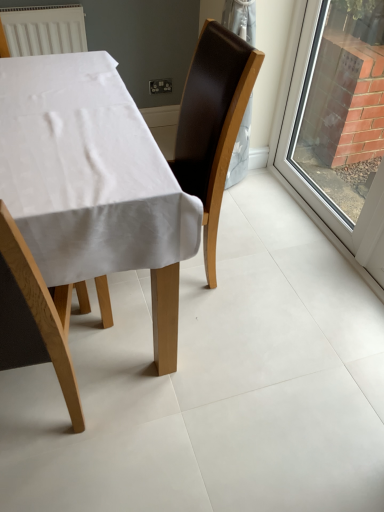
Question: Are clear glass window at right and brown leather chair at center, the first chair positioned from the back, far apart?

Choices:
 (A) no
 (B) yes

Answer: (A)

Question: Considering the relative sizes of clear glass window at right and brown leather chair at center, the first chair positioned from the back, in the image provided, is clear glass window at right smaller than brown leather chair at center, the first chair positioned from the back,?

Choices:
 (A) no
 (B) yes

Answer: (B)

Question: Does clear glass window at right contain brown leather chair at center, the first chair positioned from the back?

Choices:
 (A) yes
 (B) no

Answer: (B)

Question: Is brown leather chair at center, the first chair positioned from the back, at the back of clear glass window at right?

Choices:
 (A) no
 (B) yes

Answer: (A)

Question: Is clear glass window at right thinner than brown leather chair at center, the first chair positioned from the back?

Choices:
 (A) yes
 (B) no

Answer: (A)

Question: From a real-world perspective, is clear glass window at right on brown leather chair at center, the 2th chair from the front?

Choices:
 (A) no
 (B) yes

Answer: (B)

Question: From the image's perspective, is wooden chair at lower left, the first chair viewed from the front, under clear glass window at right?

Choices:
 (A) no
 (B) yes

Answer: (B)

Question: Is the position of wooden chair at lower left, which is counted as the second chair, starting from the back, more distant than that of clear glass window at right?

Choices:
 (A) yes
 (B) no

Answer: (B)

Question: Is wooden chair at lower left, the first chair viewed from the front, smaller than clear glass window at right?

Choices:
 (A) yes
 (B) no

Answer: (A)

Question: Is wooden chair at lower left, which is counted as the second chair, starting from the back, in front of clear glass window at right?

Choices:
 (A) yes
 (B) no

Answer: (A)

Question: Would you consider wooden chair at lower left, which is counted as the second chair, starting from the back, to be distant from clear glass window at right?

Choices:
 (A) no
 (B) yes

Answer: (B)

Question: Does wooden chair at lower left, the first chair viewed from the front, appear on the left side of clear glass window at right?

Choices:
 (A) yes
 (B) no

Answer: (A)

Question: Is brown leather chair at center, the 2th chair from the front, not within clear glass window at right?

Choices:
 (A) yes
 (B) no

Answer: (A)